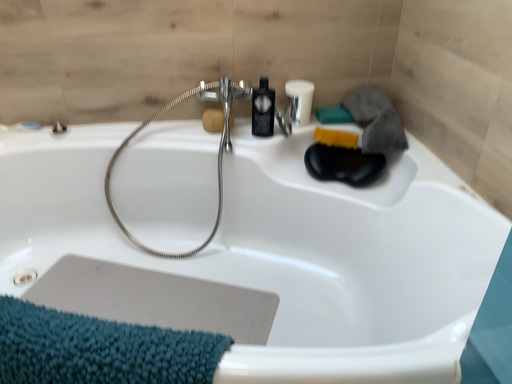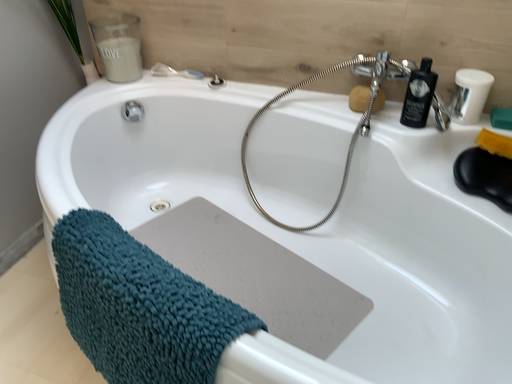
Question: How did the camera likely rotate when shooting the video?

Choices:
 (A) rotated right
 (B) rotated left

Answer: (B)